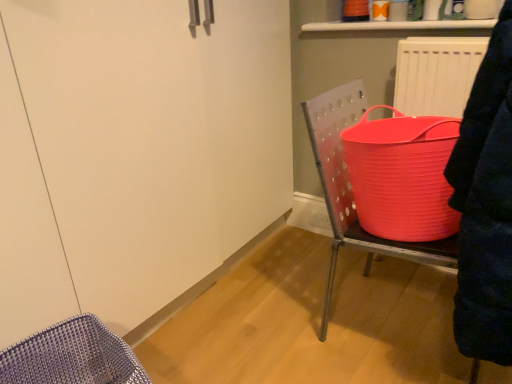
Image resolution: width=512 pixels, height=384 pixels. I want to click on free spot to the left of rubberized plastic bucket at right, so click(x=275, y=321).